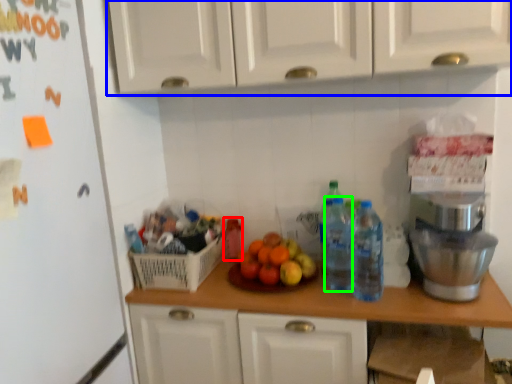
Question: Considering the real-world distances, which object is farthest from bottle (highlighted by a red box)? cabinetry (highlighted by a blue box) or bottle (highlighted by a green box)?

Choices:
 (A) cabinetry
 (B) bottle

Answer: (A)